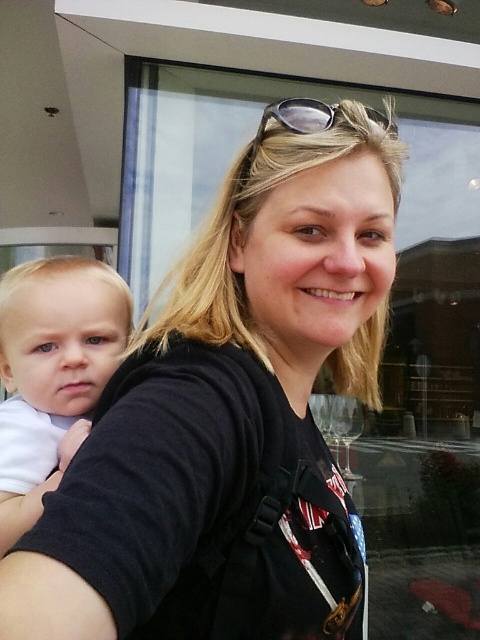
You are a photographer trying to focus on the white soft baby at left while the black matte shirt at center is in the way. Can you adjust your camera to focus on the baby without moving any objects?

The black matte shirt at center is closer to the viewer than the white soft baby at left. To focus on the baby, you need to adjust the camera to focus on a farther object, but since the shirt is closer, it may block the view unless you change your angle or move closer to the baby.

Looking at this image, you are a photographer adjusting the camera focus. You notice the white soft baby at left and the sunglasses at center in your frame. Which object should you focus on first if you want to ensure the larger object is sharp?

The white soft baby at left is bigger than the sunglasses at center, so you should focus on the white soft baby at left first to ensure it is sharp.